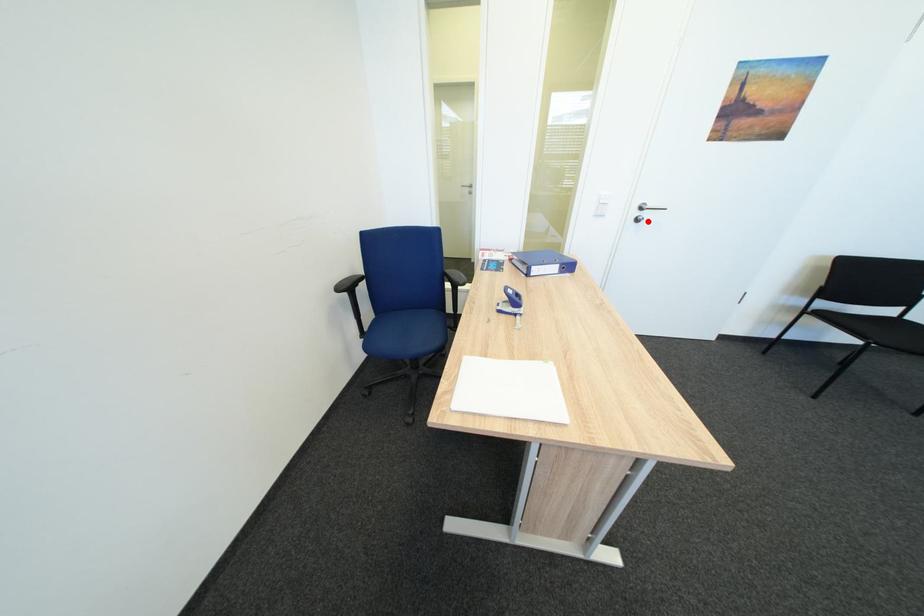
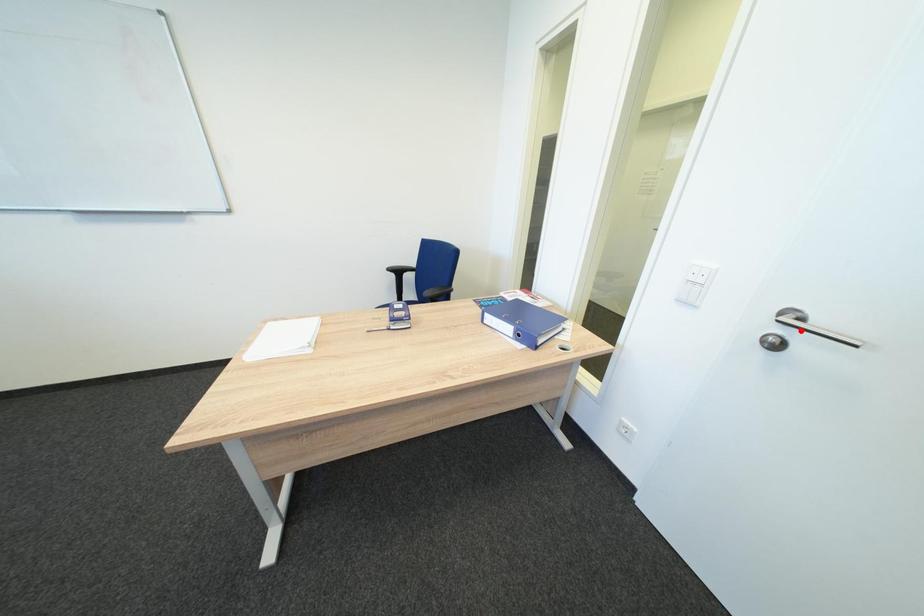
I am providing you with two images of the same scene from different viewpoints. A red point is marked on the first image and another point is marked on the second image. Is the red point in image1 aligned with the point shown in image2?

No